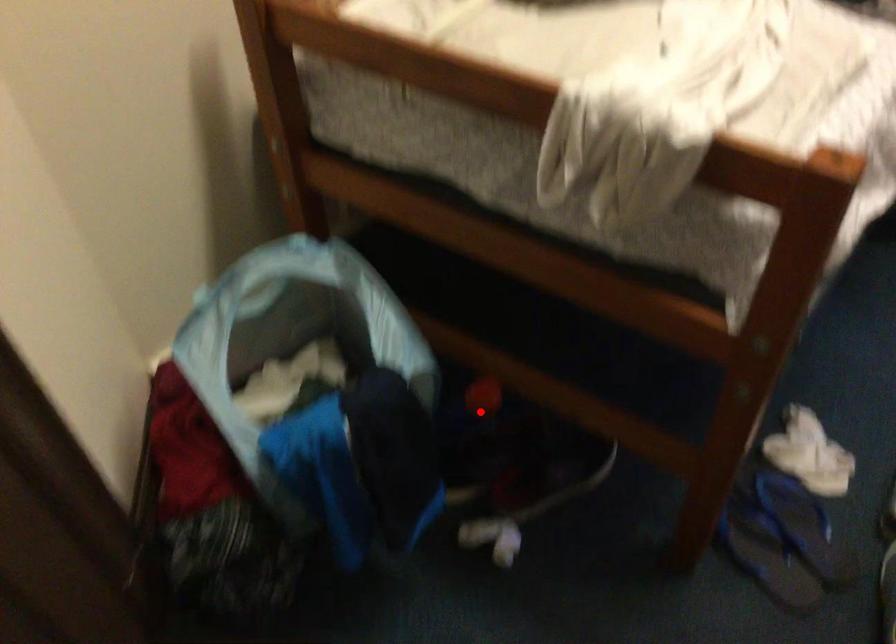
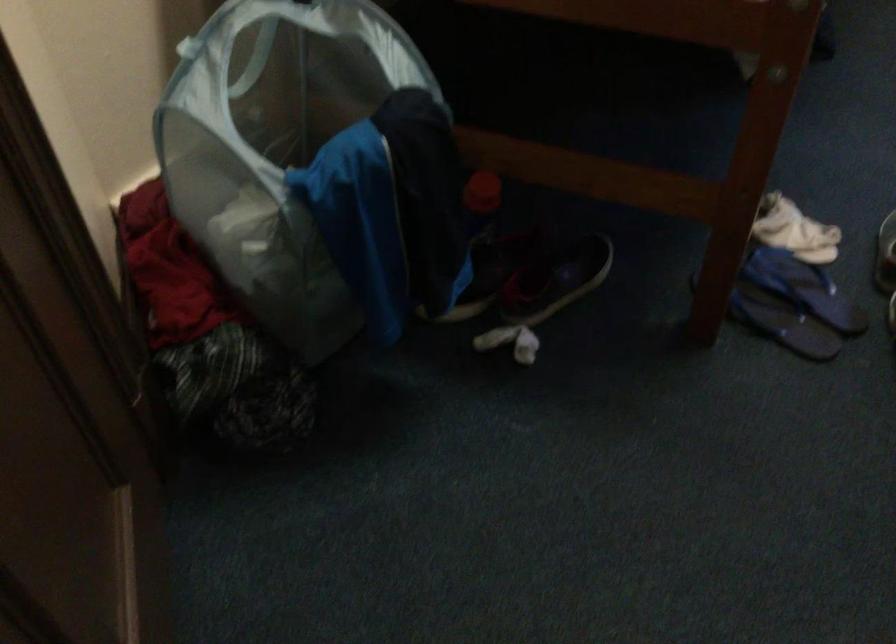
In the second image, find the point that corresponds to the highlighted location in the first image.

(480, 202)